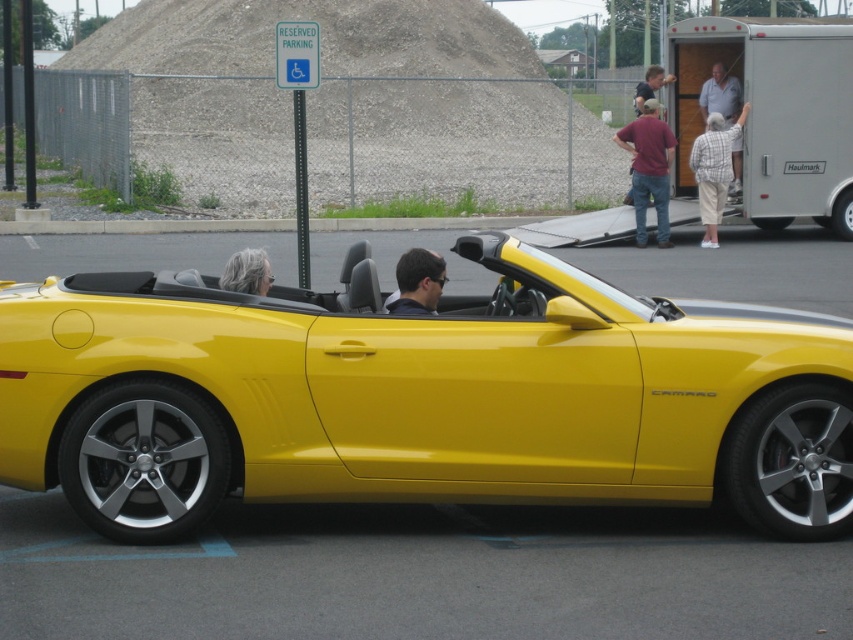
Can you confirm if shiny yellow convertible at center is bigger than plaid shirt at center?

Correct, shiny yellow convertible at center is larger in size than plaid shirt at center.

Does shiny yellow convertible at center have a greater height compared to plaid shirt at center?

Incorrect, shiny yellow convertible at center's height is not larger of plaid shirt at center's.

The image size is (853, 640). Find the location of `shiny yellow convertible at center`. shiny yellow convertible at center is located at coordinates (421, 397).

Does plaid shirt at center have a lesser width compared to matte black hair at center?

No, plaid shirt at center is not thinner than matte black hair at center.

How distant is plaid shirt at center from matte black hair at center?

11.43 meters

Is point (723, 177) closer to viewer compared to point (432, 278)?

No, (723, 177) is behind (432, 278).

The height and width of the screenshot is (640, 853). In order to click on plaid shirt at center in this screenshot , I will do `click(714, 170)`.

Which of these two, plaid shirt at upper right or gray hair at center, stands shorter?

gray hair at center is shorter.

Between plaid shirt at upper right and gray hair at center, which one appears on the left side from the viewer's perspective?

gray hair at center is more to the left.

Is point (718, 67) positioned before point (264, 289)?

No, (718, 67) is further to viewer.

This screenshot has height=640, width=853. What are the coordinates of `plaid shirt at upper right` in the screenshot? It's located at (720, 93).